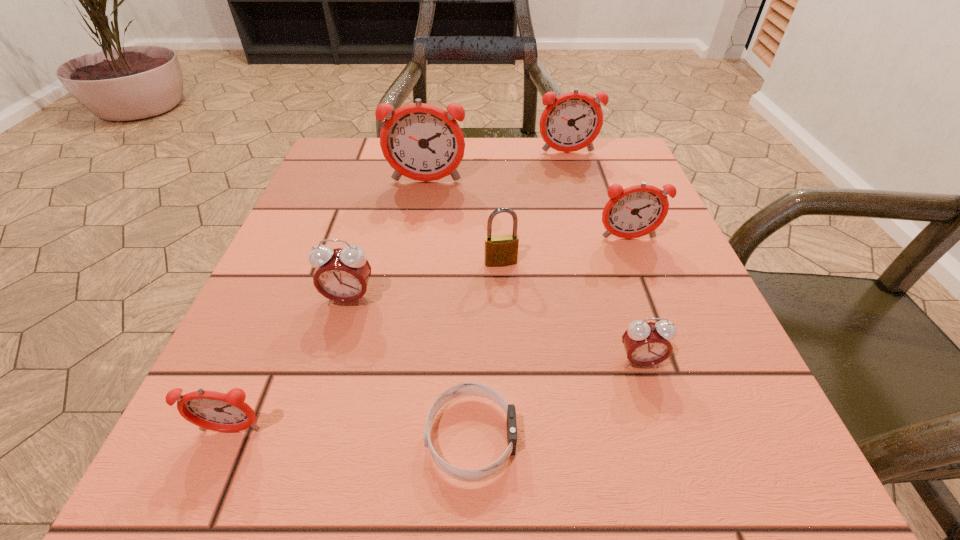
This screenshot has width=960, height=540. Find the location of `the smaller pink alarm clock`. the smaller pink alarm clock is located at coordinates (646, 343).

This screenshot has width=960, height=540. I want to click on the nearer pink alarm clock, so click(x=646, y=343).

Locate an element on the screen. The width and height of the screenshot is (960, 540). the leftmost object is located at coordinates (212, 410).

What are the coordinates of `the leftmost alarm clock` in the screenshot? It's located at (212, 410).

Image resolution: width=960 pixels, height=540 pixels. In order to click on the shortest object in this screenshot , I will do `click(467, 388)`.

Locate an element on the screen. free region located on the front-facing side of the tallest alarm clock is located at coordinates (419, 231).

Identify the location of vacant position located on the front-facing side of the second tallest object. The image size is (960, 540). (601, 269).

Find the location of a particular element. This screenshot has height=540, width=960. vacant space located on the clock face of the fourth nearest object is located at coordinates (329, 367).

Identify the location of vacant region located 0.070m on the front-facing side of the second nearest reddish-pink alarm clock. The height and width of the screenshot is (540, 960). (639, 269).

The width and height of the screenshot is (960, 540). Find the location of `vacant area situated 0.360m on the front of the brass padlock`. vacant area situated 0.360m on the front of the brass padlock is located at coordinates (512, 481).